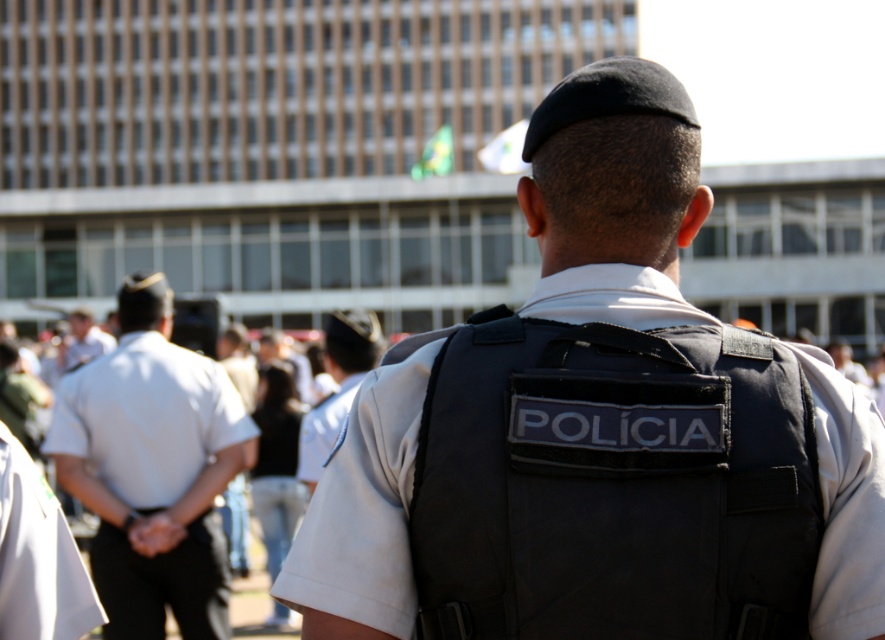
You are a photographer positioned at the camera location. You want to take a photo of the police officer in the scene. Which point, point (744, 477) or point (310, 488), is closer to your camera and thus more likely to be in focus if you focus on it?

Point (744, 477) is closer to the camera than point (310, 488), so focusing on it would make that point more likely to be in focus.

You are a photographer trying to capture a clear shot of the white fabric shirt at center and the light brown leather jacket at left. Which object should you focus on first if you want to ensure both are in focus without adjusting your camera settings?

The white fabric shirt at center is not as tall as the light brown leather jacket at left, so you should focus on the light brown leather jacket at left first since it is taller and might require more depth of field to capture details properly.

You are a photographer standing in front of the scene. You need to take a photo that includes both the white uniform shirt at center and the light brown leather jacket at left. Which object will appear larger in the photo?

The white uniform shirt at center will appear larger in the photo because it is closer to the viewer than the light brown leather jacket at left.